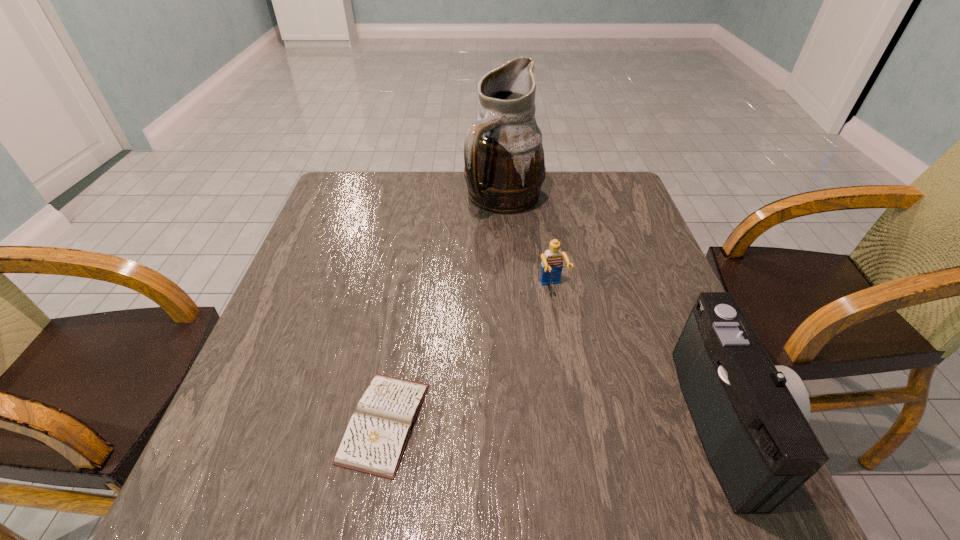
The image size is (960, 540). I want to click on free space at the far edge of the desktop, so click(448, 209).

In the image, there is a desktop. Identify the location of vacant space at the near edge. This screenshot has width=960, height=540. (625, 443).

Locate an element on the screen. free space at the left edge of the desktop is located at coordinates (308, 272).

In the image, there is a desktop. Find the location of `free space at the right edge`. free space at the right edge is located at coordinates 657,347.

Find the location of `blank area at the far left corner`. blank area at the far left corner is located at coordinates (343, 173).

The image size is (960, 540). In order to click on vacant region at the far right corner of the desktop in this screenshot , I will do `click(595, 193)`.

Find the location of `free space between the third tallest object and the camcorder`. free space between the third tallest object and the camcorder is located at coordinates (640, 355).

Locate an element on the screen. The height and width of the screenshot is (540, 960). free space between the farthest object and the third shortest object is located at coordinates (616, 310).

Image resolution: width=960 pixels, height=540 pixels. Find the location of `vacant area between the Lego and the rightmost object`. vacant area between the Lego and the rightmost object is located at coordinates (640, 355).

This screenshot has height=540, width=960. What are the coordinates of `free space between the shortest object and the third nearest object` in the screenshot? It's located at (468, 355).